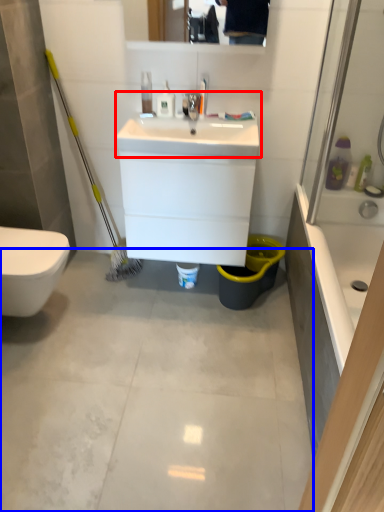
Question: Which object is further to the camera taking this photo, sink (highlighted by a red box) or concrete (highlighted by a blue box)?

Choices:
 (A) sink
 (B) concrete

Answer: (A)